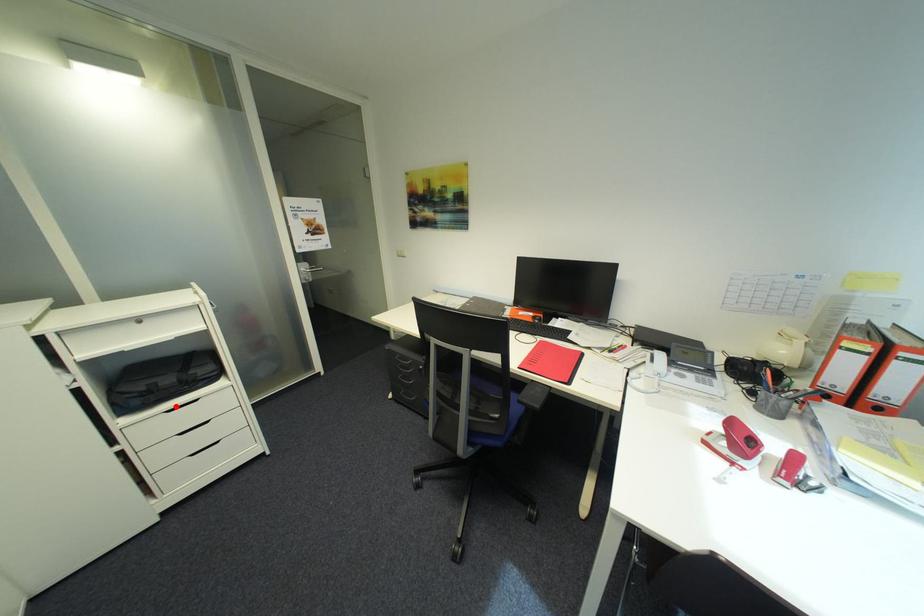
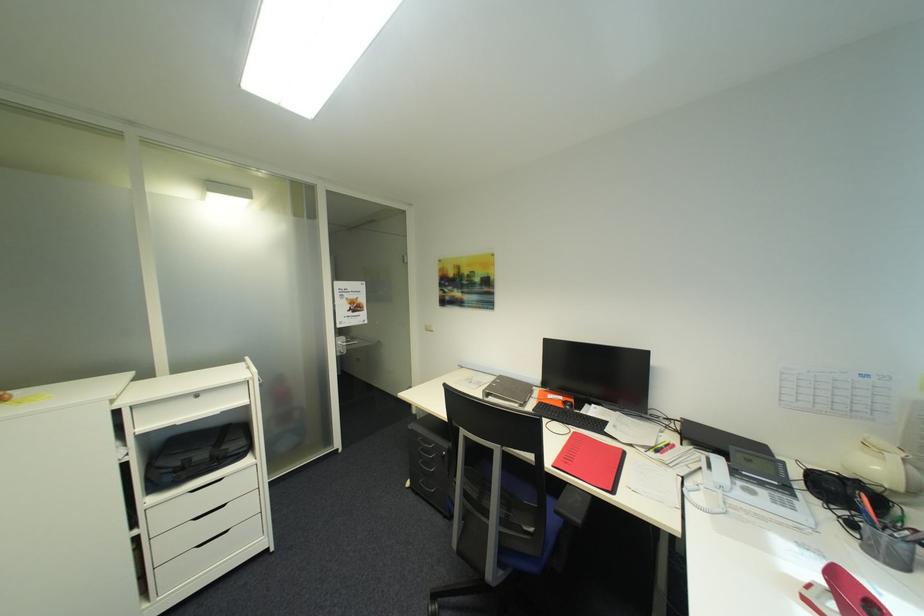
Locate, in the second image, the point that corresponds to the highlighted location in the first image.

(202, 485)